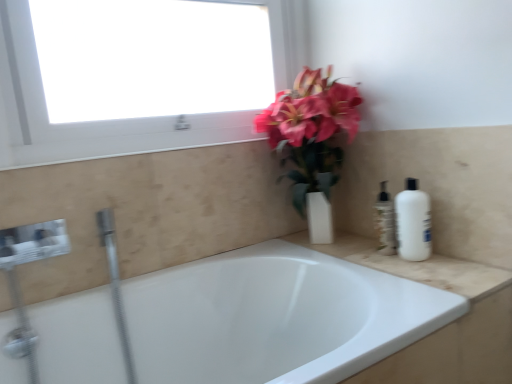
Locate an element on the screen. This screenshot has height=384, width=512. vacant area that is in front of white matte bottle at right is located at coordinates (449, 271).